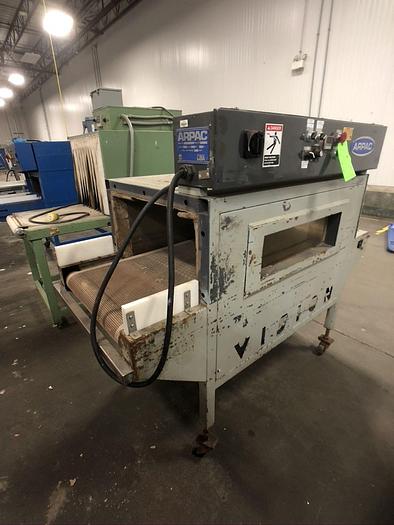
This screenshot has height=525, width=394. What are the coordinates of `overhead light` in the screenshot? It's located at (62, 25), (16, 78), (8, 92), (3, 102).